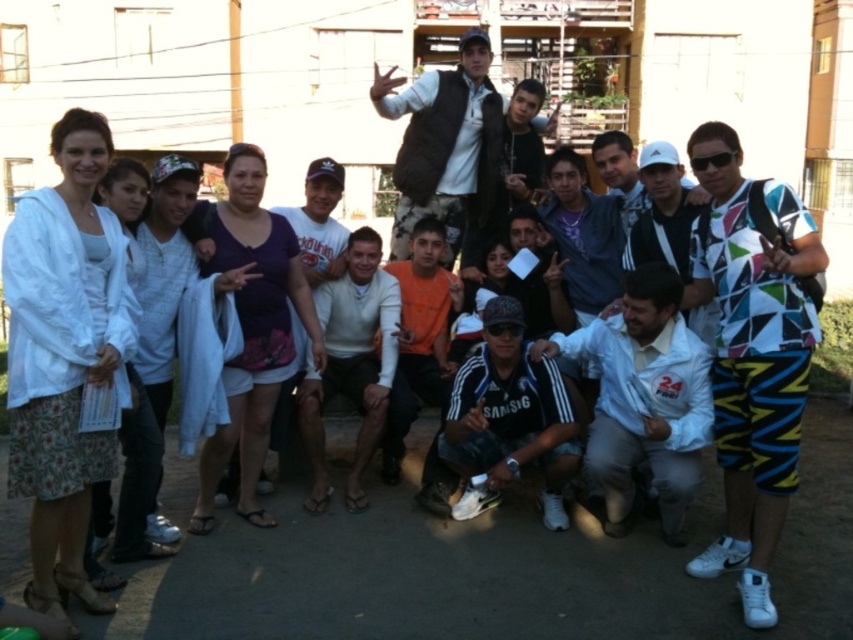
Is brown suede vest at upper center to the left of white adidas cap at center from the viewer's perspective?

Correct, you'll find brown suede vest at upper center to the left of white adidas cap at center.

What do you see at coordinates (445, 144) in the screenshot? The height and width of the screenshot is (640, 853). I see `brown suede vest at upper center` at bounding box center [445, 144].

Where is `brown suede vest at upper center`? brown suede vest at upper center is located at coordinates (445, 144).

Is point (660, 262) behind point (370, 257)?

No.

Which is more to the left, white matte jacket at lower right or white sweater at center?

Positioned to the left is white sweater at center.

Who is more distant from viewer, (566, 340) or (358, 232)?

The point (358, 232) is behind.

The image size is (853, 640). Identify the location of white matte jacket at lower right. (643, 400).

Between brown suede vest at upper center and white sweater at center, which one has less height?

With less height is brown suede vest at upper center.

In the scene shown: Is the position of brown suede vest at upper center less distant than that of white sweater at center?

That is False.

The image size is (853, 640). I want to click on brown suede vest at upper center, so click(445, 144).

I want to click on brown suede vest at upper center, so click(x=445, y=144).